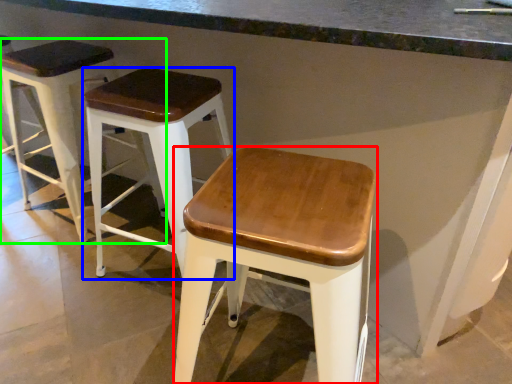
Question: Which object is positioned closest to stool (highlighted by a red box)? Select from stool (highlighted by a blue box) and stool (highlighted by a green box).

Choices:
 (A) stool
 (B) stool

Answer: (A)